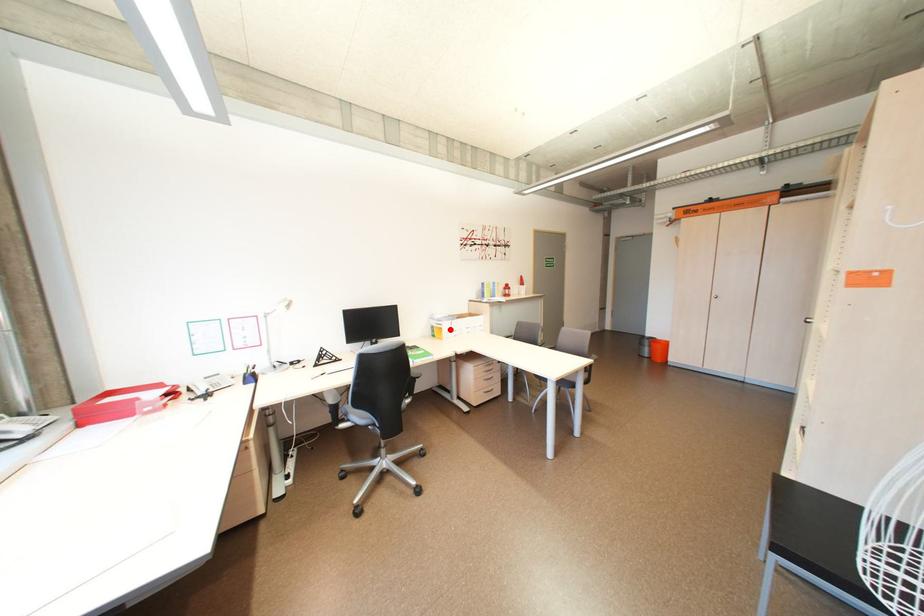
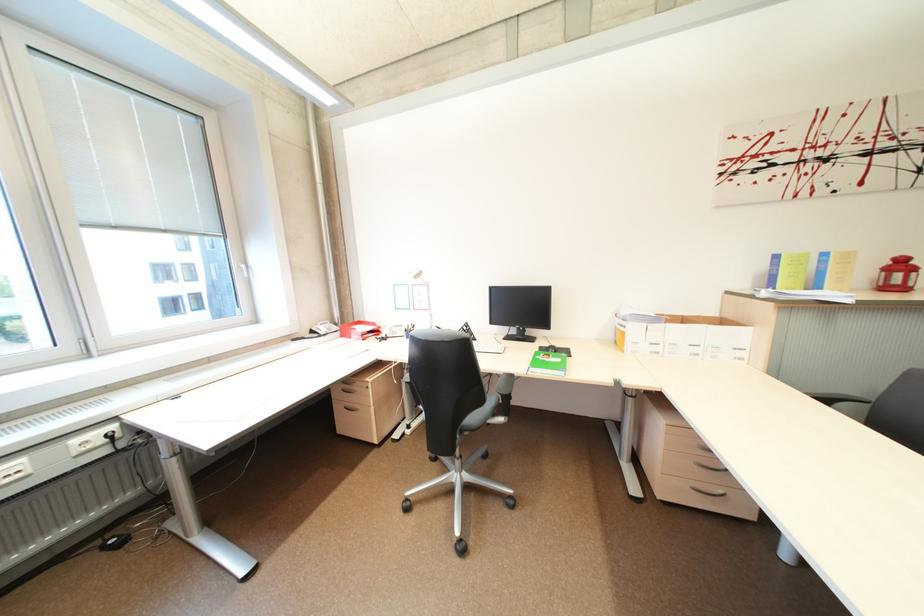
Question: A red point is marked in image1. In image2, is the corresponding 3D point closer to the camera or farther? Reply with the corresponding letter.

Choices:
 (A) The corresponding 3D point is closer.
 (B) The corresponding 3D point is farther.

Answer: (A)